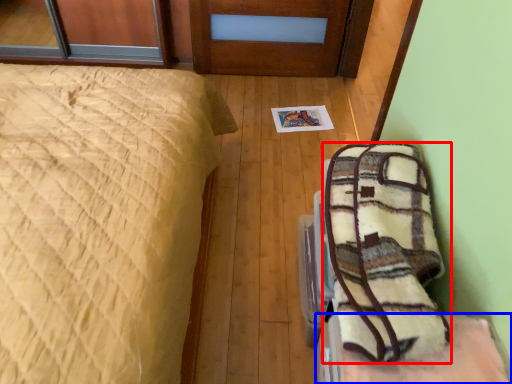
Question: Among these objects, which one is farthest to the camera, blanket (highlighted by a red box) or furniture (highlighted by a blue box)?

Choices:
 (A) blanket
 (B) furniture

Answer: (B)